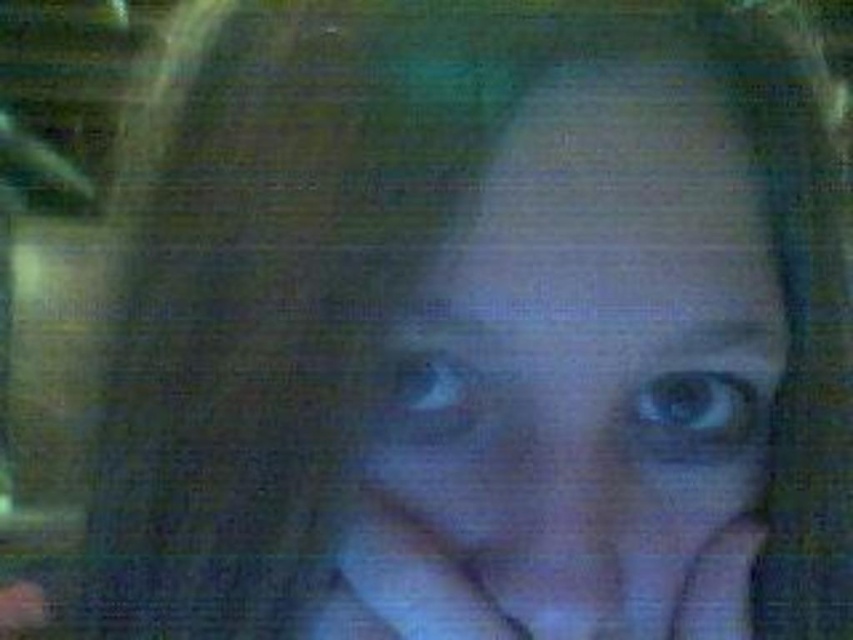
Question: Is smooth skin face at center below matte skin hand at center?

Choices:
 (A) no
 (B) yes

Answer: (A)

Question: Does smooth skin face at center appear on the left side of matte skin hand at center?

Choices:
 (A) no
 (B) yes

Answer: (A)

Question: Which point is closer to the camera taking this photo?

Choices:
 (A) click(x=459, y=579)
 (B) click(x=442, y=592)

Answer: (B)

Question: Does smooth skin face at center appear on the right side of matte skin hand at center?

Choices:
 (A) yes
 (B) no

Answer: (A)

Question: Which of the following is the closest to the observer?

Choices:
 (A) (634, 192)
 (B) (404, 577)

Answer: (A)